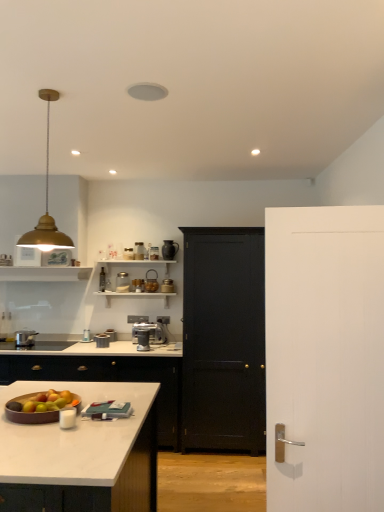
Identify the location of vacant space situated above gold metallic pendant light at upper left (from a real-world perspective). (44, 92).